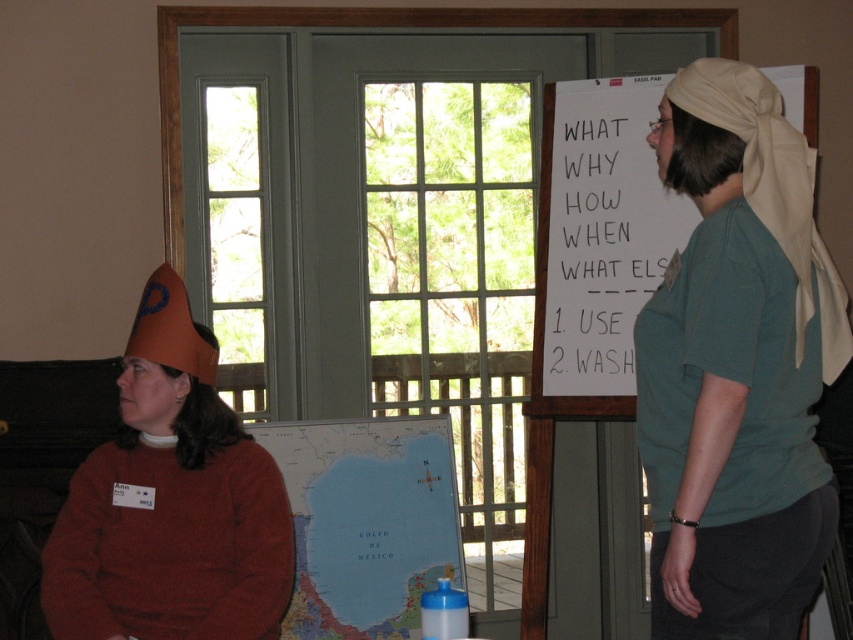
Can you confirm if orange felt cone hat at left is positioned above map paper at center?

Yes, orange felt cone hat at left is above map paper at center.

Who is lower down, orange felt cone hat at left or map paper at center?

Positioned lower is map paper at center.

Is point (163, 296) behind point (310, 499)?

No, (163, 296) is closer to viewer.

This screenshot has height=640, width=853. Identify the location of orange felt cone hat at left. pos(170,502).

You are a GUI agent. You are given a task and a screenshot of the screen. Output one action in this format:
    pyautogui.click(x=<x>, y=<y>)
    Task: Click on the green cotton shirt at right
    The height and width of the screenshot is (640, 853).
    Given the screenshot: What is the action you would take?
    pyautogui.click(x=737, y=365)

Who is positioned more to the right, green cotton shirt at right or orange felt cone hat at left?

green cotton shirt at right is more to the right.

Does point (675, 284) lie behind point (155, 404)?

No, it is in front of (155, 404).

The image size is (853, 640). In order to click on green cotton shirt at right in this screenshot , I will do `click(737, 365)`.

Between point (251, 612) and point (614, 276), which one is positioned behind?

Point (614, 276)

The width and height of the screenshot is (853, 640). Find the location of `orange felt cone hat at left`. orange felt cone hat at left is located at coordinates (170, 502).

Is point (196, 483) behind point (560, 380)?

No, it is not.

Locate an element on the screen. This screenshot has width=853, height=640. orange felt cone hat at left is located at coordinates [170, 502].